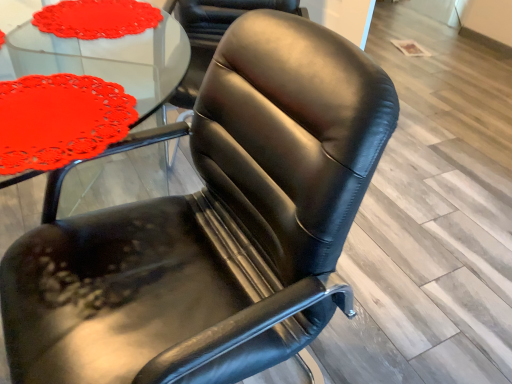
Question: Is matte glass table at upper left at the left side of matte red doily at upper left?

Choices:
 (A) yes
 (B) no

Answer: (B)

Question: Is matte glass table at upper left not near matte red doily at upper left?

Choices:
 (A) yes
 (B) no

Answer: (B)

Question: From a real-world perspective, is matte glass table at upper left located beneath matte red doily at upper left?

Choices:
 (A) no
 (B) yes

Answer: (A)

Question: Considering the relative sizes of matte glass table at upper left and matte red doily at upper left in the image provided, is matte glass table at upper left taller than matte red doily at upper left?

Choices:
 (A) yes
 (B) no

Answer: (A)

Question: Is matte glass table at upper left thinner than matte red doily at upper left?

Choices:
 (A) yes
 (B) no

Answer: (A)

Question: From the image's perspective, is black leather chair at center positioned above or below matte glass table at upper left?

Choices:
 (A) above
 (B) below

Answer: (A)

Question: Is black leather chair at center taller or shorter than matte glass table at upper left?

Choices:
 (A) tall
 (B) short

Answer: (A)

Question: Is point (224, 29) closer or farther from the camera than point (139, 34)?

Choices:
 (A) farther
 (B) closer

Answer: (B)

Question: Would you say black leather chair at center is inside or outside matte glass table at upper left?

Choices:
 (A) inside
 (B) outside

Answer: (B)

Question: Is matte red doily at upper left in front of or behind black leather chair at center in the image?

Choices:
 (A) behind
 (B) front

Answer: (B)

Question: Looking at their shapes, would you say matte red doily at upper left is wider or thinner than black leather chair at center?

Choices:
 (A) wide
 (B) thin

Answer: (B)

Question: From a real-world perspective, is matte red doily at upper left above or below black leather chair at center?

Choices:
 (A) below
 (B) above

Answer: (B)

Question: Do you think matte red doily at upper left is within black leather chair at center, or outside of it?

Choices:
 (A) inside
 (B) outside

Answer: (B)

Question: From a real-world perspective, relative to matte red doily at upper left, is black leather chair at center vertically above or below?

Choices:
 (A) below
 (B) above

Answer: (A)

Question: From the image's perspective, relative to matte red doily at upper left, is black leather chair at center above or below?

Choices:
 (A) below
 (B) above

Answer: (B)